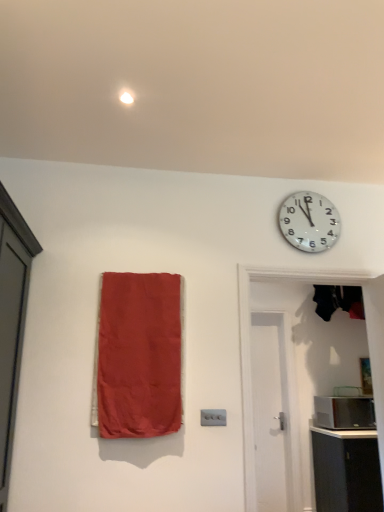
You are a GUI agent. You are given a task and a screenshot of the screen. Output one action in this format:
    pyautogui.click(x=<x>, y=<y>)
    Task: Click on the matte black cabinet at lower right
    This screenshot has width=384, height=512.
    Given the screenshot: What is the action you would take?
    pyautogui.click(x=346, y=470)

Identify the location of white matte door at right, the second door viewed from the back. This screenshot has width=384, height=512. (250, 348).

The height and width of the screenshot is (512, 384). What do you see at coordinates (344, 413) in the screenshot?
I see `black glossy microwave at right` at bounding box center [344, 413].

Find the location of a particular element. white wooden door at right, marked as the 1th door in a back-to-front arrangement is located at coordinates (268, 412).

Is matte black cabinet at lower right positioned with its back to matte fabric curtain at left?

matte black cabinet at lower right is not turned away from matte fabric curtain at left.

Does matte black cabinet at lower right have a larger size compared to matte fabric curtain at left?

Yes.

Choose the correct answer: Is matte black cabinet at lower right inside matte fabric curtain at left or outside it?

The correct answer is: outside.

From a real-world perspective, is matte black cabinet at lower right positioned over matte fabric curtain at left based on gravity?

No, from a real-world perspective, matte black cabinet at lower right is not on top of matte fabric curtain at left.

Which of these two, white wooden door at right, marked as the 1th door in a back-to-front arrangement, or white matte door at right, the second door viewed from the back, stands shorter?

white matte door at right, the second door viewed from the back.

From a real-world perspective, does white wooden door at right, marked as the 1th door in a back-to-front arrangement, sit lower than white matte door at right, which ranks as the first door in front-to-back order?

Indeed, from a real-world perspective, white wooden door at right, marked as the 1th door in a back-to-front arrangement, is positioned beneath white matte door at right, which ranks as the first door in front-to-back order.

How far apart are white wooden door at right, marked as the 1th door in a back-to-front arrangement, and white matte door at right, the second door viewed from the back?

They are 5.56 feet apart.

Can you confirm if white wooden door at right, the 2th door in the front-to-back sequence, is bigger than white matte door at right, the second door viewed from the back?

No, white wooden door at right, the 2th door in the front-to-back sequence, is not bigger than white matte door at right, the second door viewed from the back.

Between matte fabric curtain at left and white wooden door at right, marked as the 1th door in a back-to-front arrangement, which one has larger size?

matte fabric curtain at left.

Is matte fabric curtain at left far away from white wooden door at right, marked as the 1th door in a back-to-front arrangement?

Yes, matte fabric curtain at left and white wooden door at right, marked as the 1th door in a back-to-front arrangement, are located far from each other.

Which is farther, [156,286] or [266,489]?

Point [266,489]

Who is bigger, matte fabric curtain at left or white matte door at right, the second door viewed from the back?

With larger size is white matte door at right, the second door viewed from the back.

From the image's perspective, is matte fabric curtain at left above white matte door at right, which ranks as the first door in front-to-back order?

Yes, from the image's perspective, matte fabric curtain at left is on top of white matte door at right, which ranks as the first door in front-to-back order.

Is the depth of matte fabric curtain at left greater than that of white matte door at right, which ranks as the first door in front-to-back order?

No, matte fabric curtain at left is closer to the camera.

Considering the positions of point (105, 432) and point (261, 268), is point (105, 432) closer or farther from the camera than point (261, 268)?

Clearly, point (105, 432) is closer to the camera than point (261, 268).

Which object is further away from the camera, white matte door at right, which ranks as the first door in front-to-back order, or matte black cabinet at lower right?

matte black cabinet at lower right is more distant.

How much distance is there between white matte door at right, which ranks as the first door in front-to-back order, and matte black cabinet at lower right?

white matte door at right, which ranks as the first door in front-to-back order, is 4.25 feet away from matte black cabinet at lower right.

Is white matte door at right, which ranks as the first door in front-to-back order, far away from matte black cabinet at lower right?

That's right, there is a large distance between white matte door at right, which ranks as the first door in front-to-back order, and matte black cabinet at lower right.

In terms of width, does white matte door at right, the second door viewed from the back, look wider or thinner when compared to matte black cabinet at lower right?

Clearly, white matte door at right, the second door viewed from the back, has less width compared to matte black cabinet at lower right.

At what (x,y) coordinates should I click in order to perform the action: click on door that is the 1st one when counting leftward from the black glossy microwave at right. Please return your answer as a coordinate pair (x, y). Looking at the image, I should click on (250, 348).

Looking at this image, in terms of height, does black glossy microwave at right look taller or shorter compared to white matte door at right, the second door viewed from the back?

black glossy microwave at right is shorter than white matte door at right, the second door viewed from the back.

Is black glossy microwave at right facing towards white matte door at right, which ranks as the first door in front-to-back order?

No, black glossy microwave at right is not aimed at white matte door at right, which ranks as the first door in front-to-back order.

Is matte fabric curtain at left situated inside white glossy wall clock at upper right or outside?

matte fabric curtain at left is not inside white glossy wall clock at upper right, it's outside.

Is matte fabric curtain at left not near white glossy wall clock at upper right?

matte fabric curtain at left is far away from white glossy wall clock at upper right.

In terms of width, does matte fabric curtain at left look wider or thinner when compared to white glossy wall clock at upper right?

Considering their sizes, matte fabric curtain at left looks broader than white glossy wall clock at upper right.

This screenshot has height=512, width=384. Identify the location of wall clock lying behind the matte fabric curtain at left. (309, 222).

Image resolution: width=384 pixels, height=512 pixels. What are the coordinates of `curtain on the left of matte black cabinet at lower right` in the screenshot? It's located at (139, 355).

Identify the location of door that is on the right side of white wooden door at right, marked as the 1th door in a back-to-front arrangement. (250, 348).

Based on their spatial positions, is white glossy wall clock at upper right or white wooden door at right, marked as the 1th door in a back-to-front arrangement, closer to matte fabric curtain at left?

white glossy wall clock at upper right.

Considering their positions, is matte fabric curtain at left positioned further to black glossy microwave at right than white wooden door at right, marked as the 1th door in a back-to-front arrangement?

matte fabric curtain at left.

Based on their spatial positions, is matte black cabinet at lower right or white matte door at right, which ranks as the first door in front-to-back order, further from matte fabric curtain at left?

The object further to matte fabric curtain at left is matte black cabinet at lower right.

Which object lies further to the anchor point matte black cabinet at lower right, white matte door at right, the second door viewed from the back, or black glossy microwave at right?

white matte door at right, the second door viewed from the back, lies further to matte black cabinet at lower right than the other object.

Estimate the real-world distances between objects in this image. Which object is further from matte fabric curtain at left, white glossy wall clock at upper right or white matte door at right, the second door viewed from the back?

white glossy wall clock at upper right lies further to matte fabric curtain at left than the other object.

Looking at the image, which one is located further to matte fabric curtain at left, white wooden door at right, the 2th door in the front-to-back sequence, or white glossy wall clock at upper right?

white wooden door at right, the 2th door in the front-to-back sequence, lies further to matte fabric curtain at left than the other object.

Estimate the real-world distances between objects in this image. Which object is further from white glossy wall clock at upper right, black glossy microwave at right or matte fabric curtain at left?

black glossy microwave at right.

Considering their positions, is matte fabric curtain at left positioned closer to black glossy microwave at right than white matte door at right, the second door viewed from the back?

white matte door at right, the second door viewed from the back, lies closer to black glossy microwave at right than the other object.

Where is `appliance between white glossy wall clock at upper right and matte black cabinet at lower right in the vertical direction`? appliance between white glossy wall clock at upper right and matte black cabinet at lower right in the vertical direction is located at coordinates (344, 413).

Where is `appliance located between white matte door at right, the second door viewed from the back, and white wooden door at right, the 2th door in the front-to-back sequence, in the depth direction`? The height and width of the screenshot is (512, 384). appliance located between white matte door at right, the second door viewed from the back, and white wooden door at right, the 2th door in the front-to-back sequence, in the depth direction is located at coordinates point(344,413).

Where is `appliance between matte fabric curtain at left and matte black cabinet at lower right in the horizontal direction`? appliance between matte fabric curtain at left and matte black cabinet at lower right in the horizontal direction is located at coordinates (344, 413).

I want to click on curtain between white glossy wall clock at upper right and white wooden door at right, marked as the 1th door in a back-to-front arrangement, vertically, so click(139, 355).